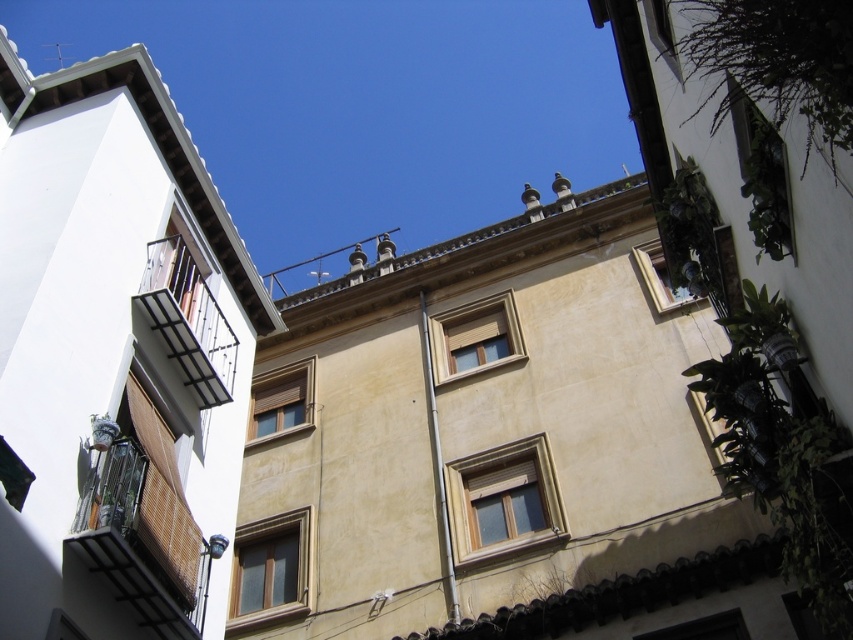
Question: Does wooden blinds at center have a larger size compared to matte glass window at upper right?

Choices:
 (A) no
 (B) yes

Answer: (A)

Question: Is rustic wood balcony at lower left to the right of brown wooden window at center from the viewer's perspective?

Choices:
 (A) yes
 (B) no

Answer: (A)

Question: Which point is farther from the camera taking this photo?

Choices:
 (A) (648, 280)
 (B) (274, 384)
 (C) (759, 140)
 (D) (264, 532)

Answer: (B)

Question: Which of the following is the farthest from the observer?

Choices:
 (A) brown wooden window at center
 (B) rustic wood balcony at lower left
 (C) wooden blinds at center
 (D) green matte window at upper right

Answer: (C)

Question: Is black wrought iron balcony at left below matte glass window at upper right?

Choices:
 (A) yes
 (B) no

Answer: (A)

Question: Among these points, which one is farthest from the camera?

Choices:
 (A) (280, 540)
 (B) (265, 387)

Answer: (B)